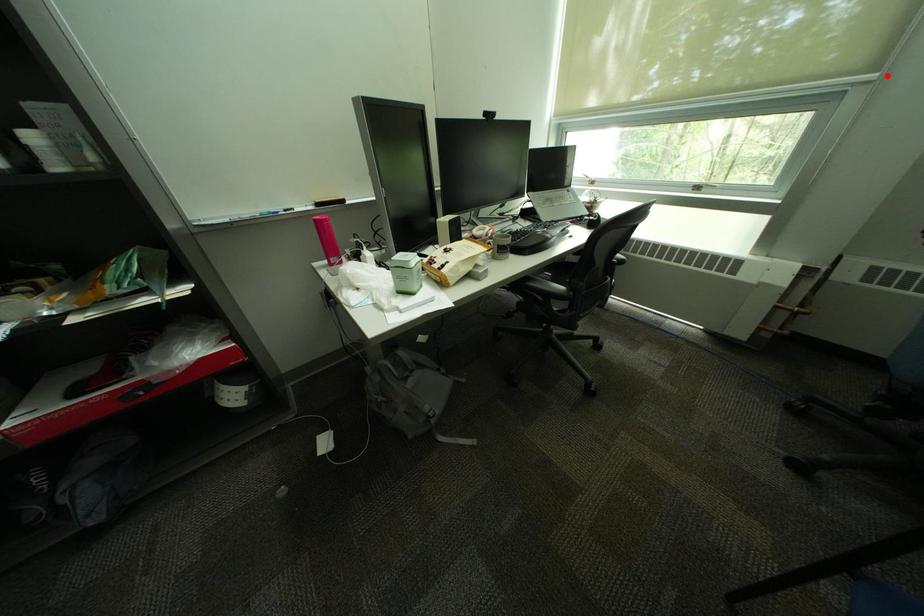
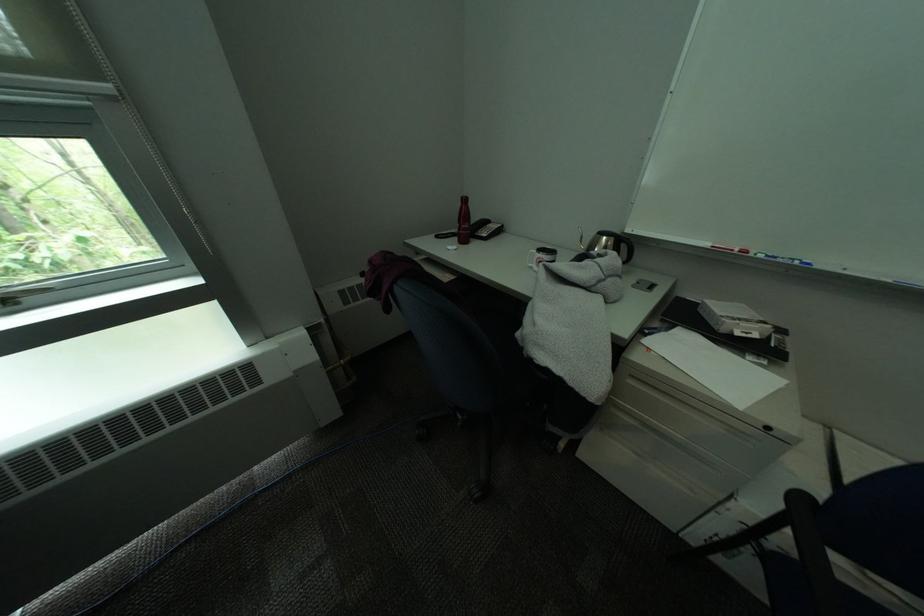
Find the pixel in the second image that matches the highlighted location in the first image.

(119, 87)